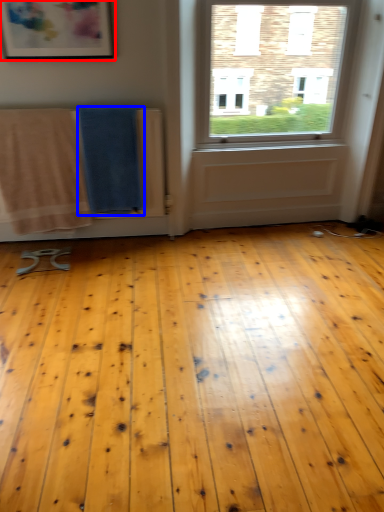
Question: Which object appears closest to the camera in this image, picture frame (highlighted by a red box) or beach towel (highlighted by a blue box)?

Choices:
 (A) picture frame
 (B) beach towel

Answer: (A)